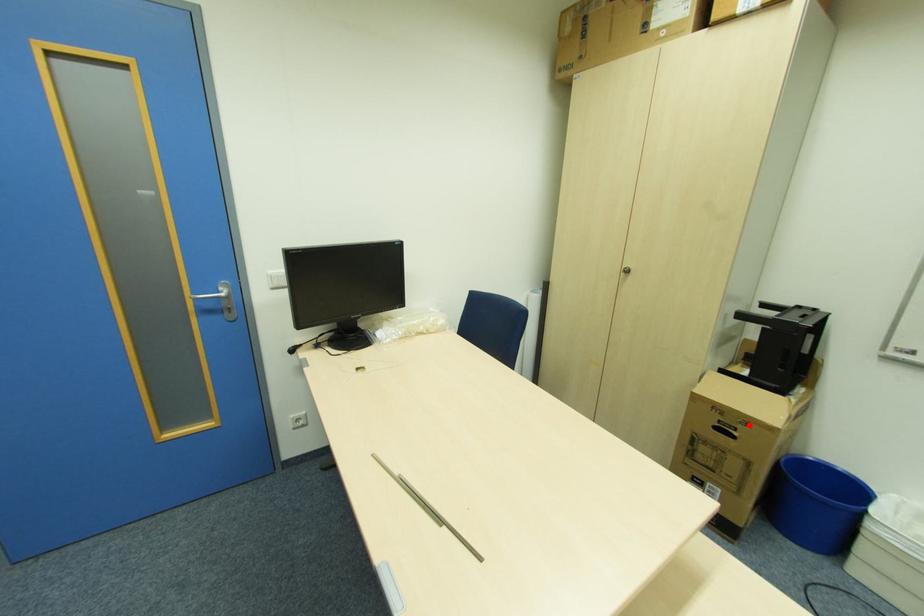
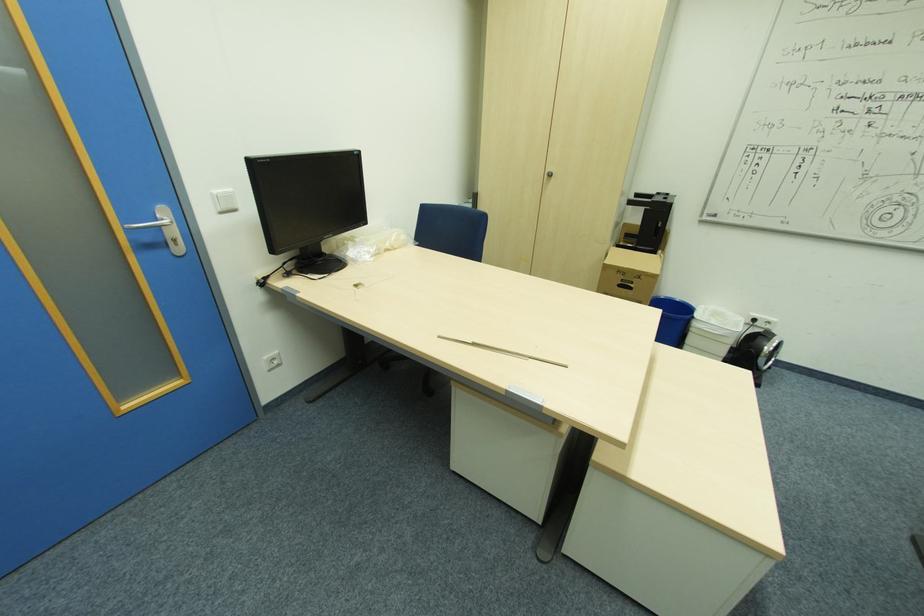
Question: I am providing you with two images of the same scene from different viewpoints. Given a red point in image1, look at the same physical point in image2. Is it:

Choices:
 (A) Closer to the viewpoint
 (B) Farther from the viewpoint

Answer: (A)